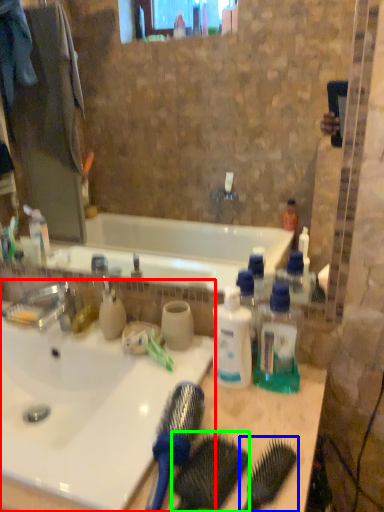
Question: Which is nearer to the sink (highlighted by a red box)? brush (highlighted by a blue box) or comb (highlighted by a green box).

Choices:
 (A) brush
 (B) comb

Answer: (B)